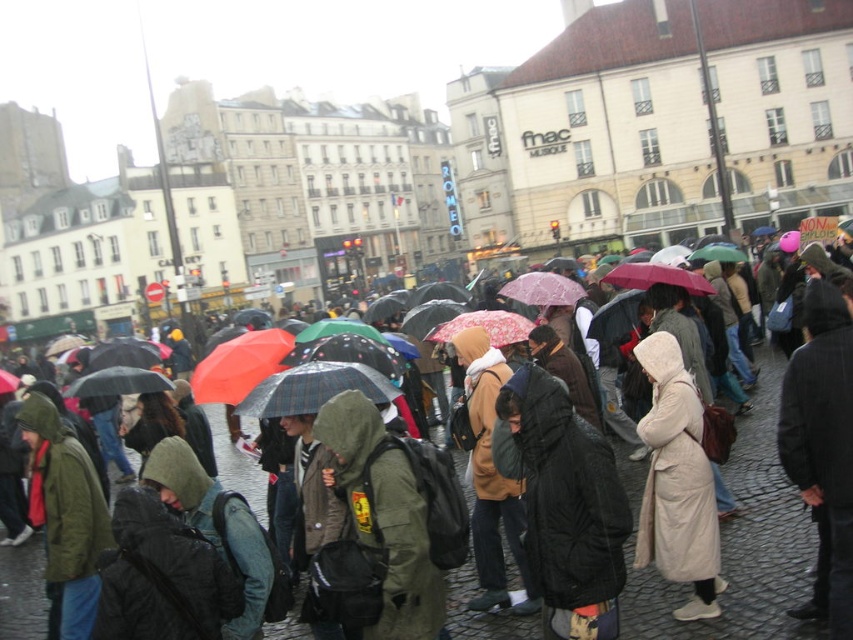
Does cobblestone pavement at center have a lesser height compared to light beige coat at center?

No.

Which is behind, point (743, 621) or point (641, 564)?

Point (641, 564)

Describe the element at coordinates (741, 545) in the screenshot. The image size is (853, 640). I see `cobblestone pavement at center` at that location.

This screenshot has width=853, height=640. I want to click on cobblestone pavement at center, so click(x=741, y=545).